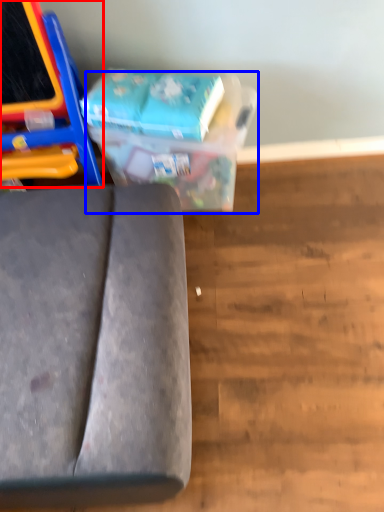
Question: Which of the following is the farthest to the observer, furniture (highlighted by a red box) or cardboard box (highlighted by a blue box)?

Choices:
 (A) furniture
 (B) cardboard box

Answer: (B)